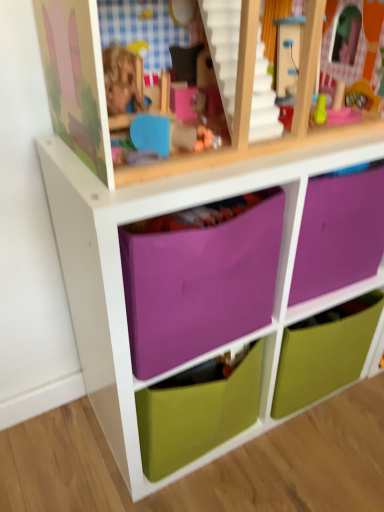
The width and height of the screenshot is (384, 512). Describe the element at coordinates (199, 280) in the screenshot. I see `purple fabric drawer at center, acting as the 2th drawer starting from the top` at that location.

Where is `purple fabric drawer at center, acting as the second drawer starting from the bottom`? The image size is (384, 512). purple fabric drawer at center, acting as the second drawer starting from the bottom is located at coordinates (199, 280).

From the image's perspective, is purple fabric drawer at center, marked as the third drawer in a bottom-to-top arrangement, above or below purple fabric drawer at center, acting as the 2th drawer starting from the top?

Clearly, from the image's perspective, purple fabric drawer at center, marked as the third drawer in a bottom-to-top arrangement, is above purple fabric drawer at center, acting as the 2th drawer starting from the top.

Is purple fabric drawer at center, marked as the third drawer in a bottom-to-top arrangement, turned away from purple fabric drawer at center, acting as the 2th drawer starting from the top?

Yes, purple fabric drawer at center, marked as the third drawer in a bottom-to-top arrangement, is facing away from purple fabric drawer at center, acting as the 2th drawer starting from the top.

From a real-world perspective, which drawer is the 1st one underneath the purple fabric drawer at center, marked as the third drawer in a bottom-to-top arrangement? Please provide its 2D coordinates.

[(199, 280)]

Consider the image. Can you confirm if purple fabric drawer at center, acting as the first drawer starting from the top, is bigger than purple fabric drawer at center, acting as the second drawer starting from the bottom?

No.

Considering the relative positions of green matte drawer at center, which appears as the first drawer when ordered from the bottom, and purple fabric drawer at center, marked as the third drawer in a bottom-to-top arrangement, in the image provided, is green matte drawer at center, which appears as the first drawer when ordered from the bottom, in front of purple fabric drawer at center, marked as the third drawer in a bottom-to-top arrangement,?

No, green matte drawer at center, which appears as the first drawer when ordered from the bottom, is further to the viewer.

From a real-world perspective, does green matte drawer at center, which appears as the first drawer when ordered from the bottom, stand above purple fabric drawer at center, marked as the third drawer in a bottom-to-top arrangement?

Incorrect, from a real-world perspective, green matte drawer at center, which appears as the first drawer when ordered from the bottom, is lower than purple fabric drawer at center, marked as the third drawer in a bottom-to-top arrangement.

Who is shorter, green matte drawer at center, which is the 3th drawer in top-to-bottom order, or purple fabric drawer at center, marked as the third drawer in a bottom-to-top arrangement?

Standing shorter between the two is purple fabric drawer at center, marked as the third drawer in a bottom-to-top arrangement.

Could you measure the distance between purple fabric drawer at center, acting as the 2th drawer starting from the top, and purple fabric drawer at center, acting as the first drawer starting from the top?

purple fabric drawer at center, acting as the 2th drawer starting from the top, and purple fabric drawer at center, acting as the first drawer starting from the top, are 1.64 inches apart.

Between purple fabric drawer at center, acting as the second drawer starting from the bottom, and purple fabric drawer at center, acting as the first drawer starting from the top, which one has larger size?

purple fabric drawer at center, acting as the second drawer starting from the bottom, is bigger.

Is purple fabric drawer at center, acting as the 2th drawer starting from the top, located outside purple fabric drawer at center, marked as the third drawer in a bottom-to-top arrangement?

Yes.

From a real-world perspective, between purple fabric drawer at center, acting as the second drawer starting from the bottom, and purple fabric drawer at center, acting as the first drawer starting from the top, who is vertically higher?

From a 3D spatial view, purple fabric drawer at center, acting as the first drawer starting from the top, is above.

Is green matte drawer at center, which is the 3th drawer in top-to-bottom order, taller or shorter than purple fabric drawer at center, acting as the second drawer starting from the bottom?

green matte drawer at center, which is the 3th drawer in top-to-bottom order, is shorter than purple fabric drawer at center, acting as the second drawer starting from the bottom.

Considering the sizes of green matte drawer at center, which appears as the first drawer when ordered from the bottom, and purple fabric drawer at center, acting as the second drawer starting from the bottom, in the image, is green matte drawer at center, which appears as the first drawer when ordered from the bottom, wider or thinner than purple fabric drawer at center, acting as the second drawer starting from the bottom,?

In the image, green matte drawer at center, which appears as the first drawer when ordered from the bottom, appears to be more narrow than purple fabric drawer at center, acting as the second drawer starting from the bottom.

Does green matte drawer at center, which appears as the first drawer when ordered from the bottom, turn towards purple fabric drawer at center, acting as the 2th drawer starting from the top?

Yes, green matte drawer at center, which appears as the first drawer when ordered from the bottom, faces towards purple fabric drawer at center, acting as the 2th drawer starting from the top.

From a real-world perspective, who is located higher, green matte drawer at center, which is the 3th drawer in top-to-bottom order, or purple fabric drawer at center, acting as the second drawer starting from the bottom?

purple fabric drawer at center, acting as the second drawer starting from the bottom, is physically above.

Is purple fabric drawer at center, acting as the second drawer starting from the bottom, spatially inside green matte drawer at center, which appears as the first drawer when ordered from the bottom, or outside of it?

purple fabric drawer at center, acting as the second drawer starting from the bottom, is not inside green matte drawer at center, which appears as the first drawer when ordered from the bottom, it's outside.

The width and height of the screenshot is (384, 512). I want to click on drawer beneath the purple fabric drawer at center, acting as the 2th drawer starting from the top (from a real-world perspective), so click(x=324, y=353).

From a real-world perspective, who is located higher, purple fabric drawer at center, acting as the second drawer starting from the bottom, or green matte drawer at center, which appears as the first drawer when ordered from the bottom?

purple fabric drawer at center, acting as the second drawer starting from the bottom, is physically above.

Is point (372, 264) farther from camera compared to point (276, 411)?

No.

Can you tell me how much purple fabric drawer at center, acting as the first drawer starting from the top, and green matte drawer at center, which is the 3th drawer in top-to-bottom order, differ in facing direction?

purple fabric drawer at center, acting as the first drawer starting from the top, and green matte drawer at center, which is the 3th drawer in top-to-bottom order, are facing 0.124 degrees away from each other.

Find the location of a particular element. drawer that is the 2nd one when counting rightward from the purple fabric drawer at center, acting as the first drawer starting from the top is located at coordinates (324, 353).

Does purple fabric drawer at center, marked as the third drawer in a bottom-to-top arrangement, have a lesser height compared to green matte drawer at center, which appears as the first drawer when ordered from the bottom?

Yes, purple fabric drawer at center, marked as the third drawer in a bottom-to-top arrangement, is shorter than green matte drawer at center, which appears as the first drawer when ordered from the bottom.

Is purple fabric drawer at center, marked as the third drawer in a bottom-to-top arrangement, at the left side of green matte drawer at center, which appears as the first drawer when ordered from the bottom?

Correct, you'll find purple fabric drawer at center, marked as the third drawer in a bottom-to-top arrangement, to the left of green matte drawer at center, which appears as the first drawer when ordered from the bottom.

At what (x,y) coordinates should I click in order to perform the action: click on drawer in front of the purple fabric drawer at center, acting as the first drawer starting from the top. Please return your answer as a coordinate pair (x, y). This screenshot has height=512, width=384. Looking at the image, I should click on (199, 280).

Locate an element on the screen. This screenshot has width=384, height=512. drawer behind the purple fabric drawer at center, marked as the third drawer in a bottom-to-top arrangement is located at coordinates (324, 353).

Estimate the real-world distances between objects in this image. Which object is closer to purple fabric drawer at center, acting as the 2th drawer starting from the top, green matte drawer at center, which is the 3th drawer in top-to-bottom order, or purple fabric drawer at center, marked as the third drawer in a bottom-to-top arrangement?

purple fabric drawer at center, marked as the third drawer in a bottom-to-top arrangement, is positioned closer to the anchor purple fabric drawer at center, acting as the 2th drawer starting from the top.

When comparing their distances from green matte drawer at center, which is the 3th drawer in top-to-bottom order, does purple fabric drawer at center, acting as the 2th drawer starting from the top, or purple fabric drawer at center, acting as the first drawer starting from the top, seem further?

purple fabric drawer at center, acting as the first drawer starting from the top, lies further to green matte drawer at center, which is the 3th drawer in top-to-bottom order, than the other object.

Estimate the real-world distances between objects in this image. Which object is closer to purple fabric drawer at center, marked as the third drawer in a bottom-to-top arrangement, purple fabric drawer at center, acting as the 2th drawer starting from the top, or green matte drawer at center, which is the 3th drawer in top-to-bottom order?

Among the two, purple fabric drawer at center, acting as the 2th drawer starting from the top, is located nearer to purple fabric drawer at center, marked as the third drawer in a bottom-to-top arrangement.

Considering their positions, is purple fabric drawer at center, marked as the third drawer in a bottom-to-top arrangement, positioned closer to purple fabric drawer at center, acting as the second drawer starting from the bottom, than green matte drawer at center, which appears as the first drawer when ordered from the bottom?

purple fabric drawer at center, marked as the third drawer in a bottom-to-top arrangement, lies closer to purple fabric drawer at center, acting as the second drawer starting from the bottom, than the other object.

Which object lies nearer to the anchor point green matte drawer at center, which is the 3th drawer in top-to-bottom order, purple fabric drawer at center, acting as the first drawer starting from the top, or purple fabric drawer at center, acting as the 2th drawer starting from the top?

purple fabric drawer at center, acting as the 2th drawer starting from the top, lies closer to green matte drawer at center, which is the 3th drawer in top-to-bottom order, than the other object.

When comparing their distances from purple fabric drawer at center, marked as the third drawer in a bottom-to-top arrangement, does green matte drawer at center, which is the 3th drawer in top-to-bottom order, or purple fabric drawer at center, acting as the second drawer starting from the bottom, seem further?

green matte drawer at center, which is the 3th drawer in top-to-bottom order, is positioned further to the anchor purple fabric drawer at center, marked as the third drawer in a bottom-to-top arrangement.

The image size is (384, 512). I want to click on drawer positioned between purple fabric drawer at center, acting as the second drawer starting from the bottom, and green matte drawer at center, which appears as the first drawer when ordered from the bottom, from near to far, so click(199, 278).